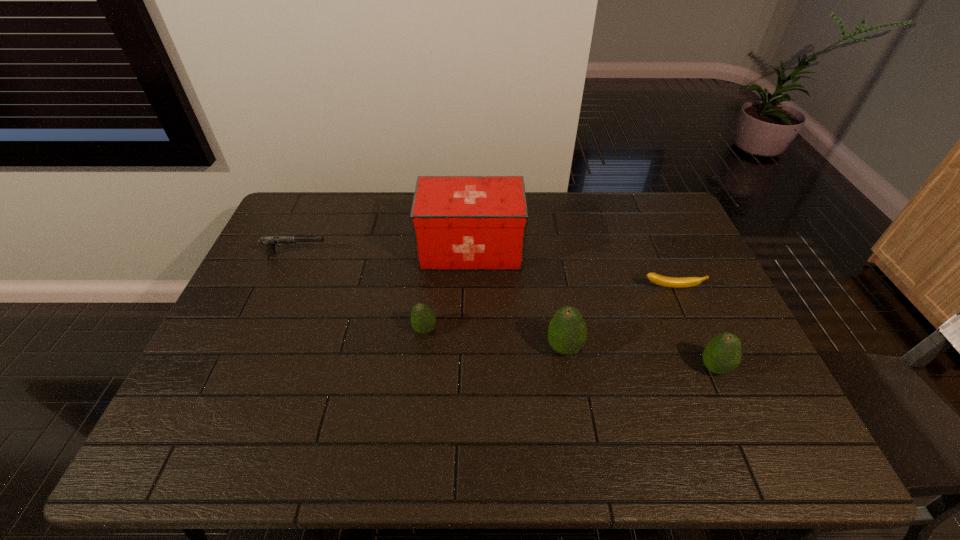
Locate an element on the screen. the third shortest object is located at coordinates (423, 320).

At what (x,y) coordinates should I click in order to perform the action: click on the shortest avocado. Please return your answer as a coordinate pair (x, y). This screenshot has height=540, width=960. Looking at the image, I should click on (423, 320).

The width and height of the screenshot is (960, 540). What are the coordinates of `the fourth object from left to right` in the screenshot? It's located at (567, 331).

Locate an element on the screen. The height and width of the screenshot is (540, 960). the tallest avocado is located at coordinates (567, 331).

At what (x,y) coordinates should I click in order to perform the action: click on the fourth shortest object. Please return your answer as a coordinate pair (x, y). The height and width of the screenshot is (540, 960). Looking at the image, I should click on (722, 355).

This screenshot has height=540, width=960. Identify the location of the rightmost avocado. (722, 355).

This screenshot has width=960, height=540. What are the coordinates of `the leftmost object` in the screenshot? It's located at click(269, 241).

You are a GUI agent. You are given a task and a screenshot of the screen. Output one action in this format:
    pyautogui.click(x=<x>, y=<y>)
    Task: Click on the fifth tallest object
    
    Given the screenshot: What is the action you would take?
    pyautogui.click(x=269, y=241)

Where is `the first-aid kit`? the first-aid kit is located at coordinates (459, 222).

This screenshot has width=960, height=540. I want to click on the third farthest object, so click(x=660, y=280).